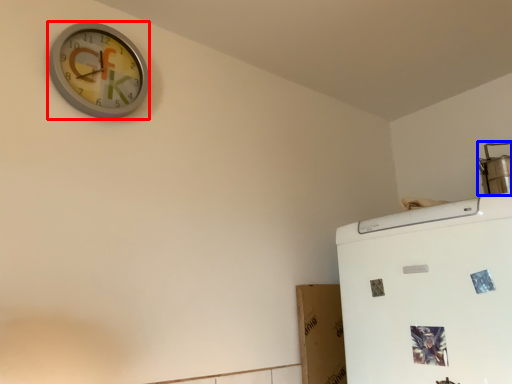
Question: Which point is closer to the camera, wall clock (highlighted by a red box) or appliance (highlighted by a blue box)?

Choices:
 (A) wall clock
 (B) appliance

Answer: (A)